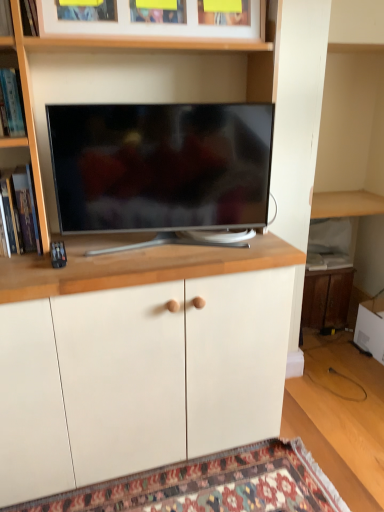
Question: Is carpeted mat at lower center aimed at wooden picture frame at upper center?

Choices:
 (A) no
 (B) yes

Answer: (A)

Question: Is wooden picture frame at upper center inside carpeted mat at lower center?

Choices:
 (A) no
 (B) yes

Answer: (A)

Question: From the image's perspective, is carpeted mat at lower center below wooden picture frame at upper center?

Choices:
 (A) no
 (B) yes

Answer: (B)

Question: Does carpeted mat at lower center have a lesser width compared to wooden picture frame at upper center?

Choices:
 (A) no
 (B) yes

Answer: (A)

Question: Is the depth of carpeted mat at lower center less than that of wooden picture frame at upper center?

Choices:
 (A) yes
 (B) no

Answer: (A)

Question: Is white matte cabinet at center, the second cabinetry in the back-to-front sequence, bigger or smaller than wooden cabinet at lower right, which ranks as the 2th cabinetry in left-to-right order?

Choices:
 (A) small
 (B) big

Answer: (B)

Question: From a real-world perspective, relative to wooden cabinet at lower right, arranged as the 1th cabinetry when viewed from the right, is white matte cabinet at center, acting as the first cabinetry starting from the front, vertically above or below?

Choices:
 (A) below
 (B) above

Answer: (B)

Question: From the image's perspective, is white matte cabinet at center, placed as the 1th cabinetry when sorted from left to right, positioned above or below wooden cabinet at lower right, which ranks as the 2th cabinetry in left-to-right order?

Choices:
 (A) below
 (B) above

Answer: (A)

Question: In terms of width, does white matte cabinet at center, which ranks as the second cabinetry in right-to-left order, look wider or thinner when compared to wooden cabinet at lower right, which is the second cabinetry from front to back?

Choices:
 (A) wide
 (B) thin

Answer: (A)

Question: From a real-world perspective, relative to wooden shelf at upper left, which ranks as the second shelf in bottom-to-top order, is carpeted mat at lower center vertically above or below?

Choices:
 (A) above
 (B) below

Answer: (B)

Question: In terms of width, does carpeted mat at lower center look wider or thinner when compared to wooden shelf at upper left, marked as the 2th shelf in a top-to-bottom arrangement?

Choices:
 (A) wide
 (B) thin

Answer: (A)

Question: In the image, is carpeted mat at lower center positioned in front of or behind wooden shelf at upper left, which ranks as the second shelf in bottom-to-top order?

Choices:
 (A) front
 (B) behind

Answer: (A)

Question: Is carpeted mat at lower center taller or shorter than wooden shelf at upper left, which ranks as the second shelf in bottom-to-top order?

Choices:
 (A) tall
 (B) short

Answer: (B)

Question: Do you think wooden bookshelf at left, the 3th shelf from the top, is within wooden cabinet at lower right, which is the second cabinetry from front to back, or outside of it?

Choices:
 (A) outside
 (B) inside

Answer: (A)

Question: From a real-world perspective, is wooden bookshelf at left, the first shelf when ordered from bottom to top, physically located above or below wooden cabinet at lower right, which ranks as the 2th cabinetry in left-to-right order?

Choices:
 (A) above
 (B) below

Answer: (A)